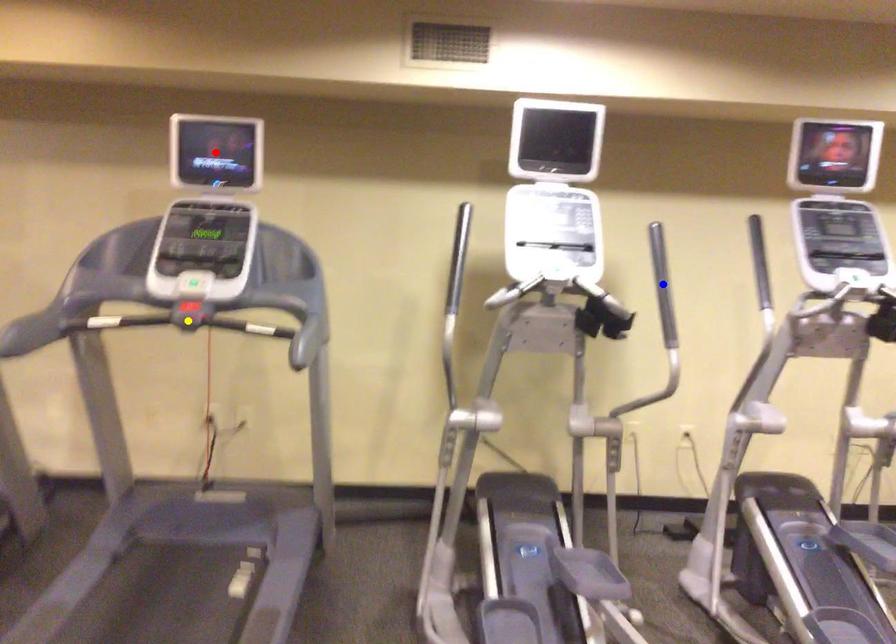
Order these from nearest to farthest:
- blue point
- red point
- yellow point

yellow point < red point < blue point